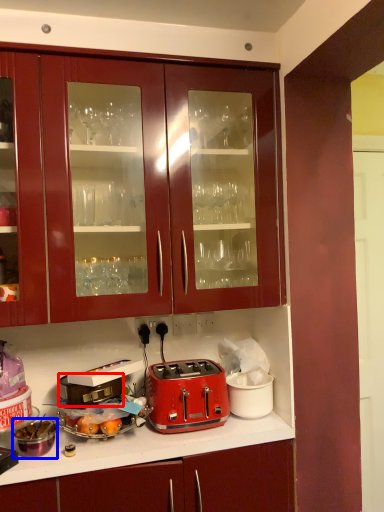
Question: Which of the following is the closest to the observer, appliance (highlighted by a red box) or appliance (highlighted by a blue box)?

Choices:
 (A) appliance
 (B) appliance

Answer: (B)